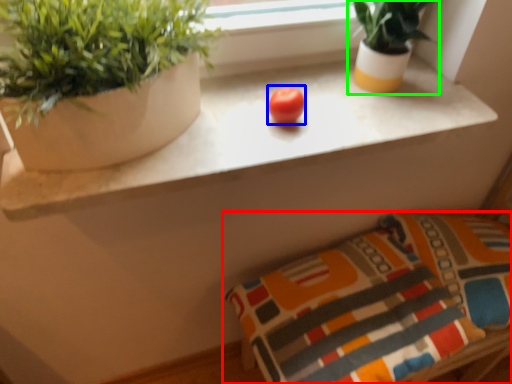
Question: Which object is the closest to the pillow (highlighted by a red box)? Choose among these: fruit (highlighted by a blue box) or houseplant (highlighted by a green box).

Choices:
 (A) fruit
 (B) houseplant

Answer: (B)